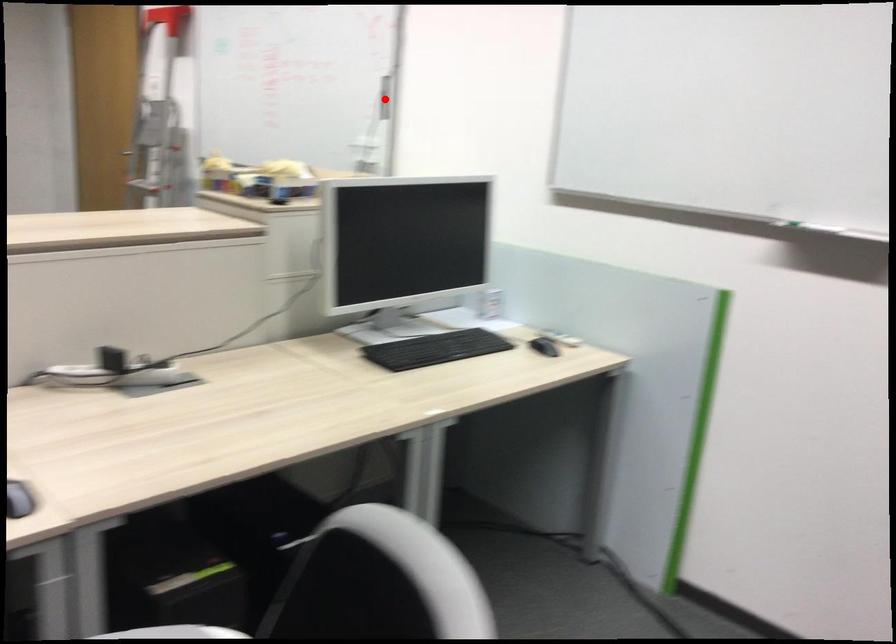
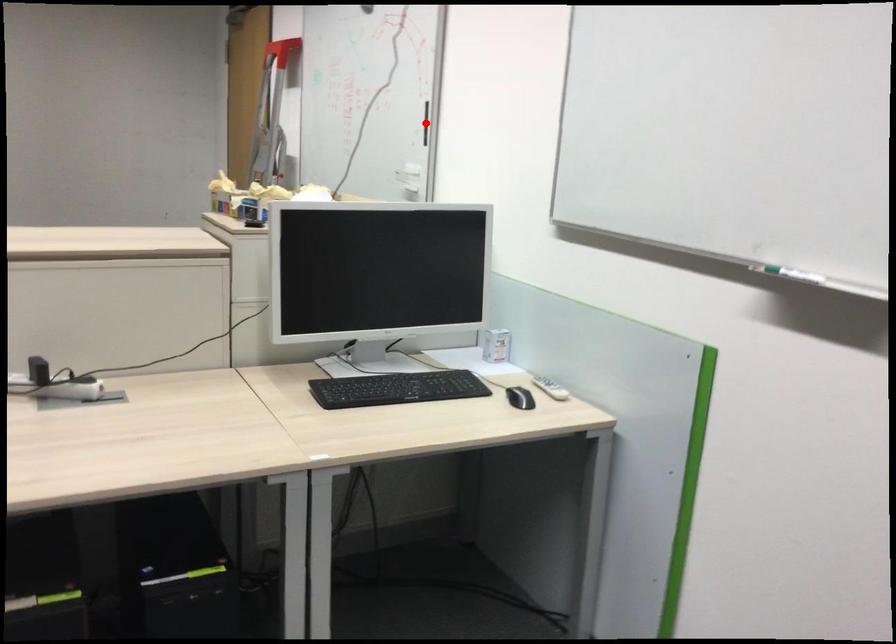
I am providing you with two images of the same scene from different viewpoints. A red point is marked on the first image and another point is marked on the second image. Is the marked point in image1 the same physical position as the marked point in image2?

Yes